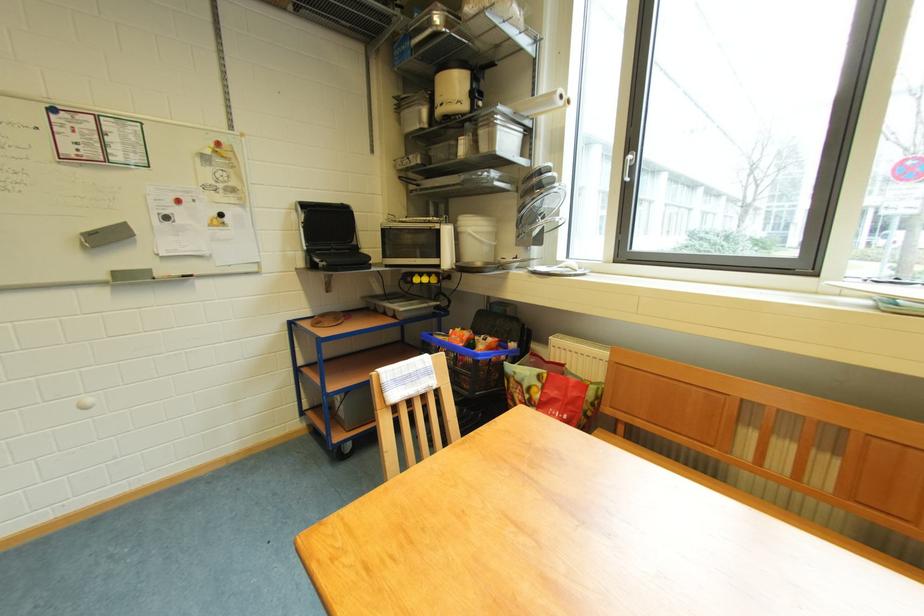
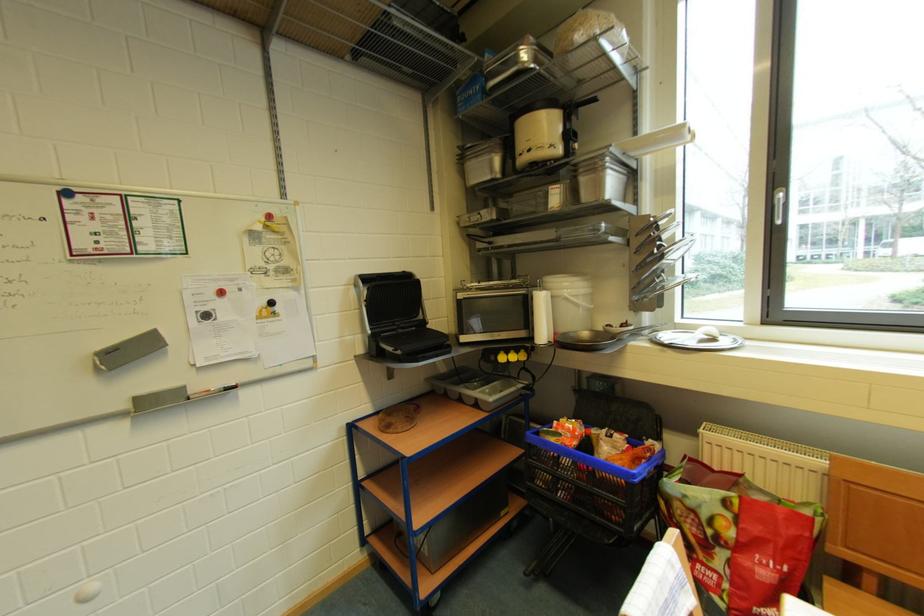
In the second image, find the point that corresponds to (x=488, y=127) in the first image.

(589, 174)